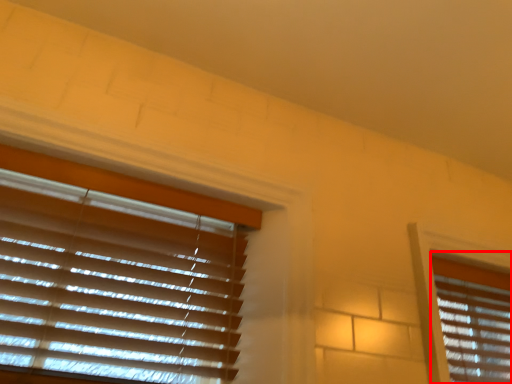
Question: From the image's perspective, considering the relative positions of window blind (annotated by the red box) and window blind in the image provided, where is window blind (annotated by the red box) located with respect to the staircase?

Choices:
 (A) above
 (B) below

Answer: (B)